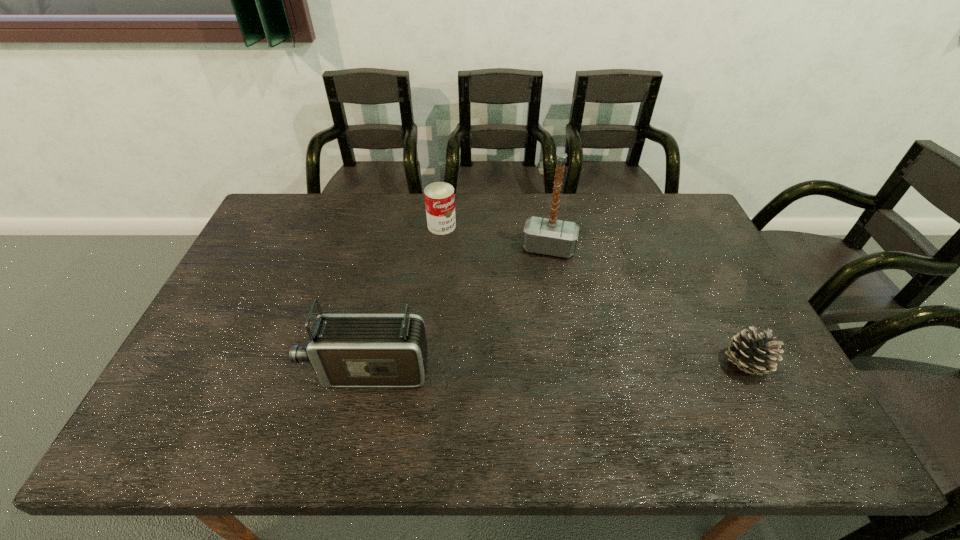
At what (x,y) coordinates should I click in order to perform the action: click on vacant space on the desktop that is between the camcorder and the rightmost object and is positioned on the striking surface of the second object from right to left. Please return your answer as a coordinate pair (x, y). Looking at the image, I should click on (525, 368).

What are the coordinates of `vacant spot on the desktop that is between the camcorder and the shortest object and is positioned on the front label of the third tallest object` in the screenshot? It's located at (560, 367).